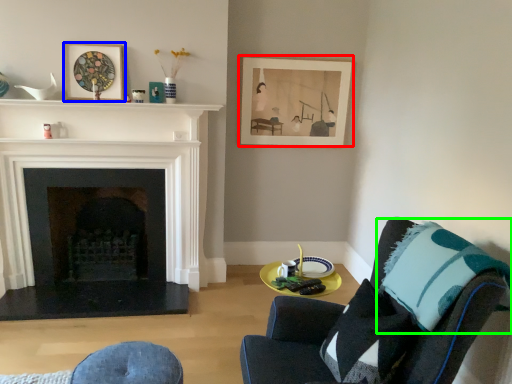
Question: Which object is positioned farthest from picture frame (highlighted by a red box)? Select from picture frame (highlighted by a blue box) and throw pillow (highlighted by a green box).

Choices:
 (A) picture frame
 (B) throw pillow

Answer: (B)